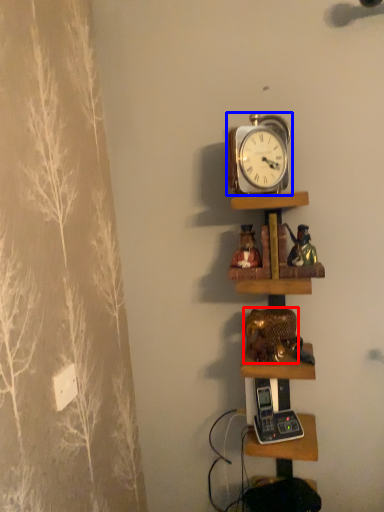
Question: Which object appears closest to the camera in this image, toy (highlighted by a red box) or alarm clock (highlighted by a blue box)?

Choices:
 (A) toy
 (B) alarm clock

Answer: (B)